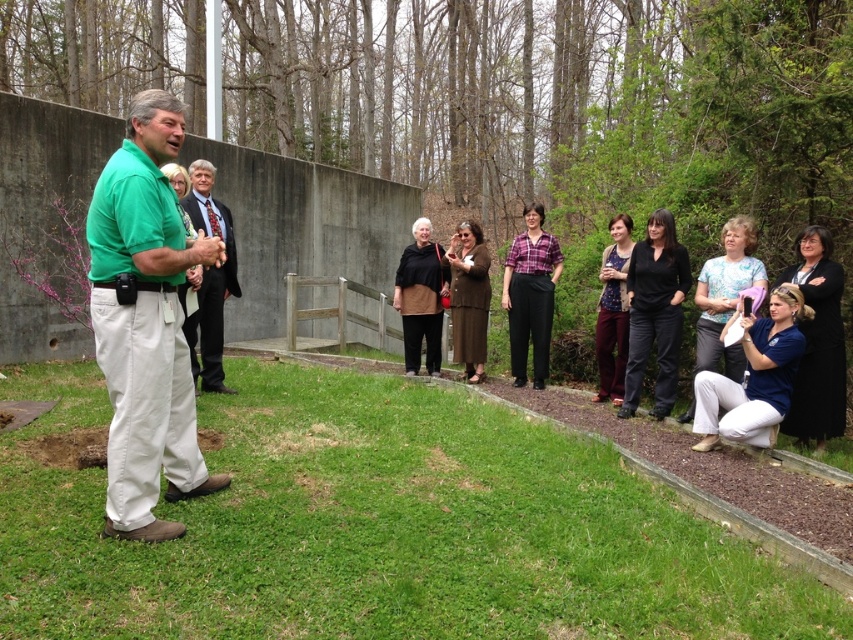
You are standing in the outdoor scene and notice the green grass at lower center and the matte black jacket at center. Which object is positioned to the right of the other?

The green grass at lower center is to the right of the matte black jacket at center.

You are organizing a charity event and need to arrange seating for two attendees based on their clothing. The green cotton shirt at left and the brown fabric dress at center are present. Which attendee should you provide a larger chair for?

The green cotton shirt at left has a larger size compared to the brown fabric dress at center, so you should provide a larger chair for the attendee wearing the green cotton shirt at left.